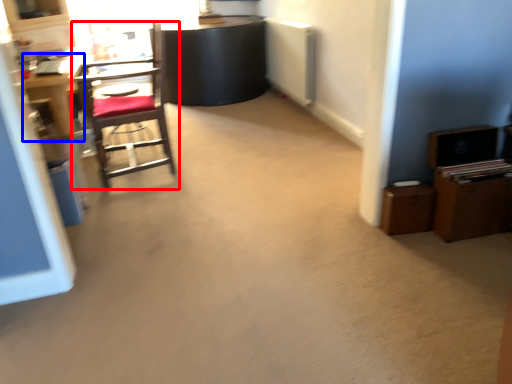
Question: Which point is further to the camera, chair (highlighted by a red box) or desk (highlighted by a blue box)?

Choices:
 (A) chair
 (B) desk

Answer: (B)